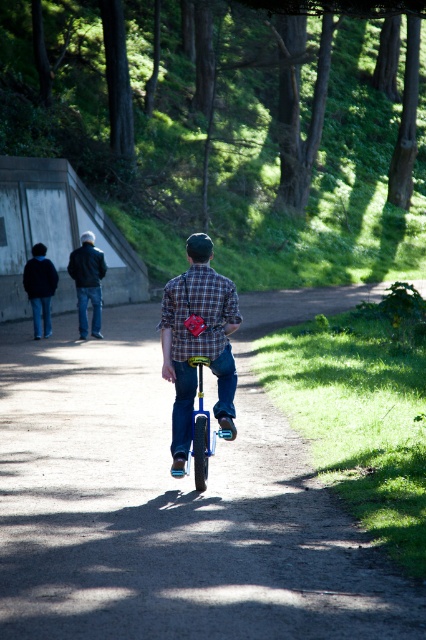
Looking at this image, is blue metallic unicycle at center thinner than dark blue jeans at center?

No, blue metallic unicycle at center is not thinner than dark blue jeans at center.

Identify the location of blue metallic unicycle at center. The height and width of the screenshot is (640, 426). (173, 499).

This screenshot has width=426, height=640. What do you see at coordinates (173, 499) in the screenshot? I see `blue metallic unicycle at center` at bounding box center [173, 499].

What are the coordinates of `blue metallic unicycle at center` in the screenshot? It's located at (173, 499).

Is plaid shirt at center to the left of blue metallic monocycle at center from the viewer's perspective?

Correct, you'll find plaid shirt at center to the left of blue metallic monocycle at center.

Does plaid shirt at center appear over blue metallic monocycle at center?

Correct, plaid shirt at center is located above blue metallic monocycle at center.

Is point (224, 308) positioned in front of point (203, 467)?

That is False.

The height and width of the screenshot is (640, 426). Find the location of `plaid shirt at center`. plaid shirt at center is located at coordinates (198, 340).

Is plaid shirt at center thinner than dark blue jeans at center?

Yes.

Which is below, plaid shirt at center or dark blue jeans at center?

plaid shirt at center

Is point (221, 362) closer to camera compared to point (97, 294)?

Yes, point (221, 362) is in front of point (97, 294).

The width and height of the screenshot is (426, 640). What are the coordinates of `plaid shirt at center` in the screenshot? It's located at (198, 340).